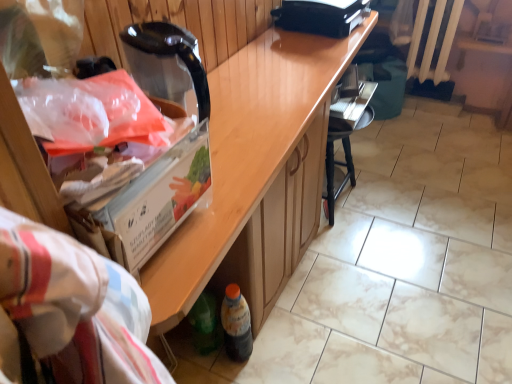
At what (x,y) coordinates should I click in order to perform the action: click on white painted metal radiator at upper right. Please return your answer as a coordinate pair (x, y). Looking at the image, I should click on (431, 40).

What do you see at coordinates (255, 172) in the screenshot?
I see `wooden cabinet at center` at bounding box center [255, 172].

What do you see at coordinates (321, 16) in the screenshot? I see `black plastic printer at upper center` at bounding box center [321, 16].

The width and height of the screenshot is (512, 384). I want to click on black plastic chair at lower center, so click(345, 131).

Considering the relative sizes of white painted metal radiator at upper right and black plastic chair at lower center in the image provided, is white painted metal radiator at upper right smaller than black plastic chair at lower center?

Indeed, white painted metal radiator at upper right has a smaller size compared to black plastic chair at lower center.

Which is correct: white painted metal radiator at upper right is inside black plastic chair at lower center, or outside of it?

The correct answer is: outside.

Who is taller, white painted metal radiator at upper right or black plastic chair at lower center?

white painted metal radiator at upper right.

Does white painted metal radiator at upper right have a smaller size compared to black plastic printer at upper center?

No.

Can you confirm if white painted metal radiator at upper right is positioned to the left of black plastic printer at upper center?

Incorrect, white painted metal radiator at upper right is not on the left side of black plastic printer at upper center.

How distant is white painted metal radiator at upper right from black plastic printer at upper center?

white painted metal radiator at upper right is 91.34 centimeters from black plastic printer at upper center.

From a real-world perspective, who is located higher, white painted metal radiator at upper right or black plastic printer at upper center?

black plastic printer at upper center is physically above.

From a real-world perspective, is translucent plastic bottle at lower center located higher than wooden cabinet at center?

Actually, translucent plastic bottle at lower center is physically below wooden cabinet at center in the real world.

Which object is wider, translucent plastic bottle at lower center or wooden cabinet at center?

wooden cabinet at center.

Is translucent plastic bottle at lower center in front of wooden cabinet at center?

No, the depth of translucent plastic bottle at lower center is greater than that of wooden cabinet at center.

From the image's perspective, is translucent plastic bottle at lower center above or below wooden cabinet at center?

Clearly, from the image's perspective, translucent plastic bottle at lower center is below wooden cabinet at center.

Does wooden cabinet at center have a smaller size compared to white painted metal radiator at upper right?

Incorrect, wooden cabinet at center is not smaller in size than white painted metal radiator at upper right.

In terms of width, does wooden cabinet at center look wider or thinner when compared to white painted metal radiator at upper right?

wooden cabinet at center is wider than white painted metal radiator at upper right.

Between wooden cabinet at center and white painted metal radiator at upper right, which one is positioned behind?

white painted metal radiator at upper right is further from the camera.

Consider the image. Is wooden cabinet at center taller than white painted metal radiator at upper right?

Yes.

From the image's perspective, which one is positioned higher, white painted metal radiator at upper right or translucent plastic bottle at lower center?

white painted metal radiator at upper right, from the image's perspective.

Is white painted metal radiator at upper right next to translucent plastic bottle at lower center?

No, white painted metal radiator at upper right is not making contact with translucent plastic bottle at lower center.

Is point (428, 47) positioned behind point (243, 360)?

Yes.

In order to click on radiator lying on the right of translucent plastic bottle at lower center in this screenshot , I will do point(431,40).

Does black plastic printer at upper center have a lesser height compared to wooden cabinet at center?

Yes, black plastic printer at upper center is shorter than wooden cabinet at center.

Is black plastic printer at upper center facing away from wooden cabinet at center?

No, black plastic printer at upper center is not facing away from wooden cabinet at center.

Considering the relative sizes of black plastic printer at upper center and wooden cabinet at center in the image provided, is black plastic printer at upper center smaller than wooden cabinet at center?

Indeed, black plastic printer at upper center has a smaller size compared to wooden cabinet at center.

Which object is positioned more to the left, white painted metal radiator at upper right or wooden cabinet at center?

wooden cabinet at center is more to the left.

Could you tell me if white painted metal radiator at upper right is turned towards wooden cabinet at center?

Yes, white painted metal radiator at upper right faces towards wooden cabinet at center.

Between white painted metal radiator at upper right and wooden cabinet at center, which one has smaller width?

white painted metal radiator at upper right is thinner.

Which is closer, (448, 29) or (237, 267)?

Point (448, 29) is positioned farther from the camera compared to point (237, 267).

Find the location of `chair located on the left of white painted metal radiator at upper right`. chair located on the left of white painted metal radiator at upper right is located at coordinates (345, 131).

In the image, there is a black plastic printer at upper center. At what (x,y) coordinates should I click in order to perform the action: click on radiator above it (from the image's perspective). Please return your answer as a coordinate pair (x, y). This screenshot has width=512, height=384. Looking at the image, I should click on (431, 40).

Considering their positions, is translucent plastic bottle at lower center positioned closer to black plastic chair at lower center than black plastic printer at upper center?

black plastic printer at upper center is positioned closer to the anchor black plastic chair at lower center.

From the picture: When comparing their distances from translucent plastic bottle at lower center, does black plastic printer at upper center or white painted metal radiator at upper right seem closer?

black plastic printer at upper center is closer to translucent plastic bottle at lower center.

When comparing their distances from black plastic chair at lower center, does black plastic printer at upper center or translucent plastic bottle at lower center seem closer?

The object closer to black plastic chair at lower center is black plastic printer at upper center.

Considering their positions, is wooden cabinet at center positioned further to black plastic printer at upper center than translucent plastic bottle at lower center?

Among the two, translucent plastic bottle at lower center is located further to black plastic printer at upper center.

Which object lies nearer to the anchor point wooden cabinet at center, white painted metal radiator at upper right or translucent plastic bottle at lower center?

Among the two, translucent plastic bottle at lower center is located nearer to wooden cabinet at center.

Considering their positions, is black plastic printer at upper center positioned further to white painted metal radiator at upper right than black plastic chair at lower center?

black plastic printer at upper center lies further to white painted metal radiator at upper right than the other object.

Estimate the real-world distances between objects in this image. Which object is closer to wooden cabinet at center, translucent plastic bottle at lower center or white painted metal radiator at upper right?

The object closer to wooden cabinet at center is translucent plastic bottle at lower center.

Considering their positions, is wooden cabinet at center positioned further to black plastic chair at lower center than black plastic printer at upper center?

The object further to black plastic chair at lower center is black plastic printer at upper center.

This screenshot has height=384, width=512. Identify the location of chair between black plastic printer at upper center and white painted metal radiator at upper right from front to back. (345, 131).

The image size is (512, 384). I want to click on bottle positioned between wooden cabinet at center and white painted metal radiator at upper right from near to far, so click(x=236, y=324).

You are a GUI agent. You are given a task and a screenshot of the screen. Output one action in this format:
    pyautogui.click(x=<x>, y=<y>)
    Task: Click on the chair between wooden cabinet at center and white painted metal radiator at upper right in the front-back direction
    This screenshot has width=512, height=384.
    Given the screenshot: What is the action you would take?
    pyautogui.click(x=345, y=131)

This screenshot has width=512, height=384. What are the coordinates of `appliance between wooden cabinet at center and white painted metal radiator at upper right along the z-axis` in the screenshot? It's located at (321, 16).